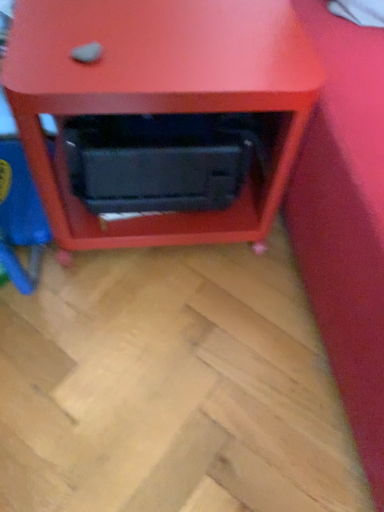
Question: Can you confirm if matte black microwave at center is smaller than black plastic drawer at center?

Choices:
 (A) yes
 (B) no

Answer: (B)

Question: Is matte black microwave at center at the left side of black plastic drawer at center?

Choices:
 (A) no
 (B) yes

Answer: (A)

Question: Is matte black microwave at center oriented away from black plastic drawer at center?

Choices:
 (A) yes
 (B) no

Answer: (A)

Question: Is matte black microwave at center not inside black plastic drawer at center?

Choices:
 (A) yes
 (B) no

Answer: (A)

Question: From a real-world perspective, is matte black microwave at center on black plastic drawer at center?

Choices:
 (A) yes
 (B) no

Answer: (A)

Question: Is matte black microwave at center at the right side of black plastic drawer at center?

Choices:
 (A) yes
 (B) no

Answer: (A)

Question: Considering the relative sizes of black plastic drawer at center and matte black microwave at center in the image provided, is black plastic drawer at center thinner than matte black microwave at center?

Choices:
 (A) no
 (B) yes

Answer: (B)

Question: Could you tell me if black plastic drawer at center is facing matte black microwave at center?

Choices:
 (A) no
 (B) yes

Answer: (B)

Question: Is black plastic drawer at center shorter than matte black microwave at center?

Choices:
 (A) yes
 (B) no

Answer: (A)

Question: Is matte black microwave at center surrounded by black plastic drawer at center?

Choices:
 (A) no
 (B) yes

Answer: (A)

Question: Considering the relative sizes of black plastic drawer at center and matte black microwave at center in the image provided, is black plastic drawer at center taller than matte black microwave at center?

Choices:
 (A) no
 (B) yes

Answer: (A)

Question: Considering the relative sizes of black plastic drawer at center and matte black microwave at center in the image provided, is black plastic drawer at center bigger than matte black microwave at center?

Choices:
 (A) no
 (B) yes

Answer: (A)

Question: Is point coord(195,75) positioned closer to the camera than point coord(91,188)?

Choices:
 (A) closer
 (B) farther

Answer: (A)